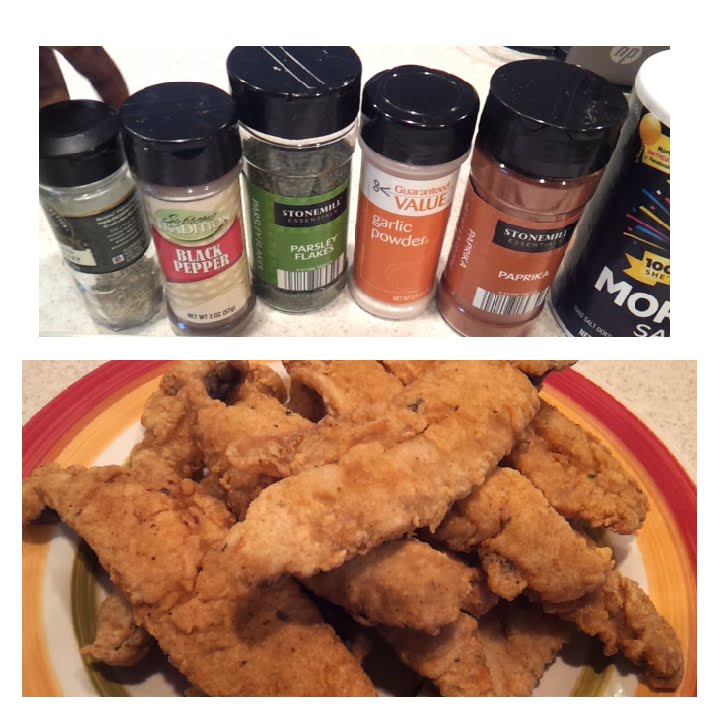
The width and height of the screenshot is (720, 720). Find the location of `morton salt container`. morton salt container is located at coordinates 626,261.